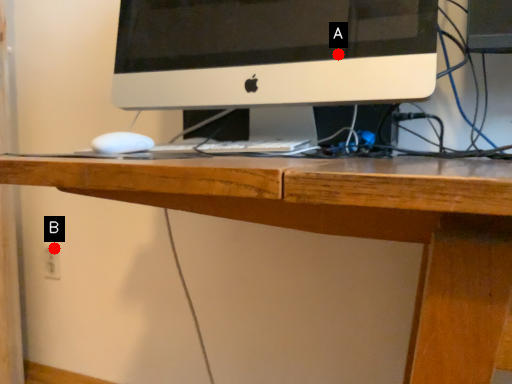
Question: Two points are circled on the image, labeled by A and B beside each circle. Among these points, which one is farthest from the camera?

Choices:
 (A) A is further
 (B) B is further

Answer: (B)